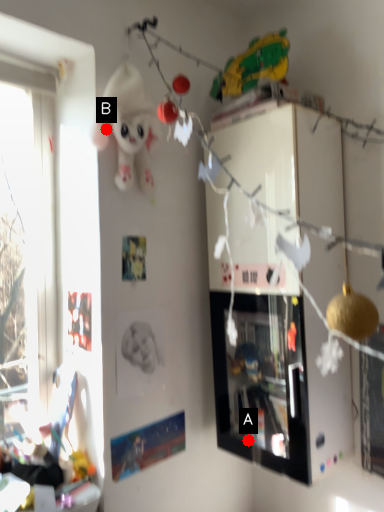
Question: Two points are circled on the image, labeled by A and B beside each circle. Which point is closer to the camera?

Choices:
 (A) A is closer
 (B) B is closer

Answer: (B)